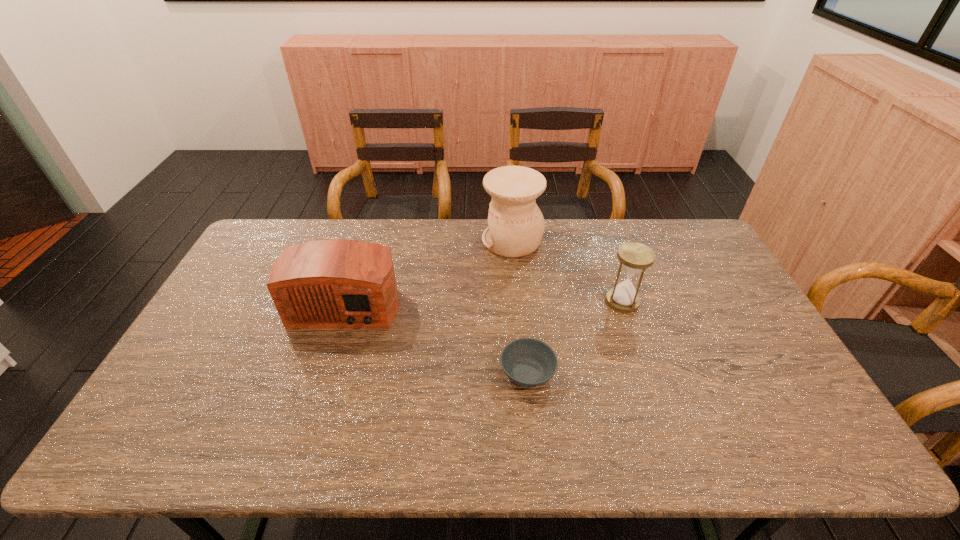
Where is `blank space located 0.190m on the left of the rightmost object`? The image size is (960, 540). blank space located 0.190m on the left of the rightmost object is located at coordinates (545, 301).

At what (x,y) coordinates should I click in order to perform the action: click on free space located 0.150m on the back of the shortest object. Please return your answer as a coordinate pair (x, y). Looking at the image, I should click on (521, 312).

Find the location of `object located at the far edge`. object located at the far edge is located at coordinates (516, 225).

The image size is (960, 540). Find the location of `vacant region at the far edge of the desktop`. vacant region at the far edge of the desktop is located at coordinates (348, 222).

I want to click on blank space at the near edge of the desktop, so (371, 448).

Find the location of a particular element. The height and width of the screenshot is (540, 960). vacant space at the left edge of the desktop is located at coordinates (216, 306).

Image resolution: width=960 pixels, height=540 pixels. In the image, there is a desktop. What are the coordinates of `vacant space at the right edge` in the screenshot? It's located at (752, 322).

Find the location of a particular element. Image resolution: width=960 pixels, height=540 pixels. vacant space at the far left corner of the desktop is located at coordinates (265, 231).

Image resolution: width=960 pixels, height=540 pixels. Identify the location of vacant space at the far right corner of the desktop. (702, 250).

At what (x,y) coordinates should I click in order to perform the action: click on free point between the shortest object and the rightmost object. Please return your answer as a coordinate pair (x, y). The width and height of the screenshot is (960, 540). Looking at the image, I should click on (575, 337).